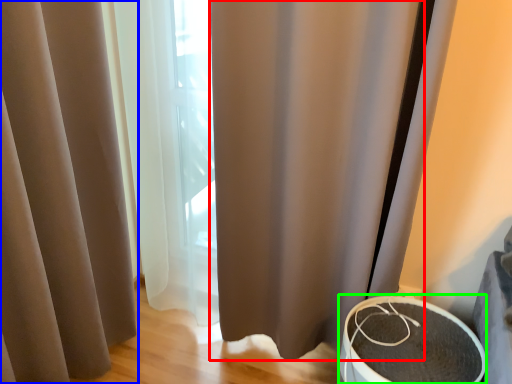
Question: Which object is the closest to the shower curtain (highlighted by a red box)? Choose among these: curtain (highlighted by a blue box) or round table (highlighted by a green box).

Choices:
 (A) curtain
 (B) round table

Answer: (B)